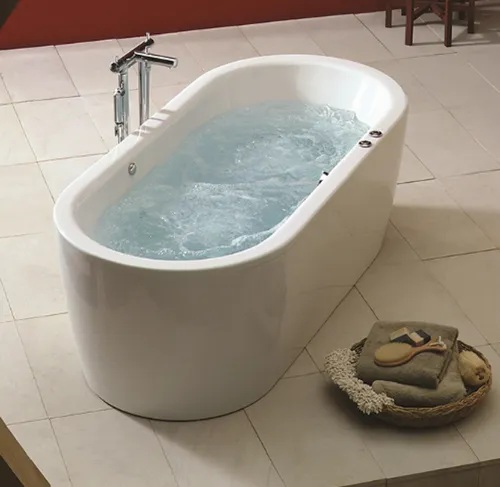
At what (x,y) coordinates should I click in order to perform the action: click on towels on bowl. Please return your answer as a coordinate pair (x, y). This screenshot has width=500, height=487. Looking at the image, I should click on (426, 367), (441, 387).